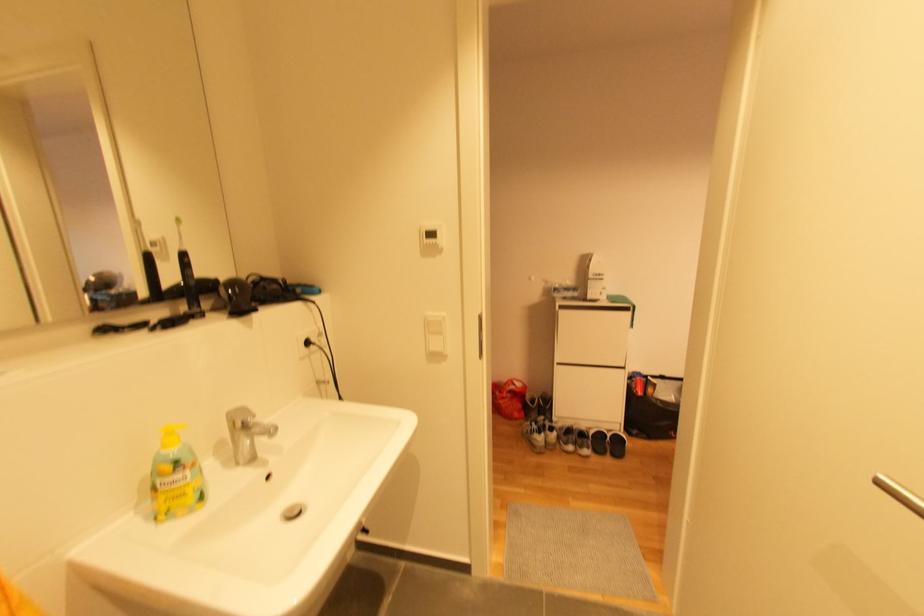
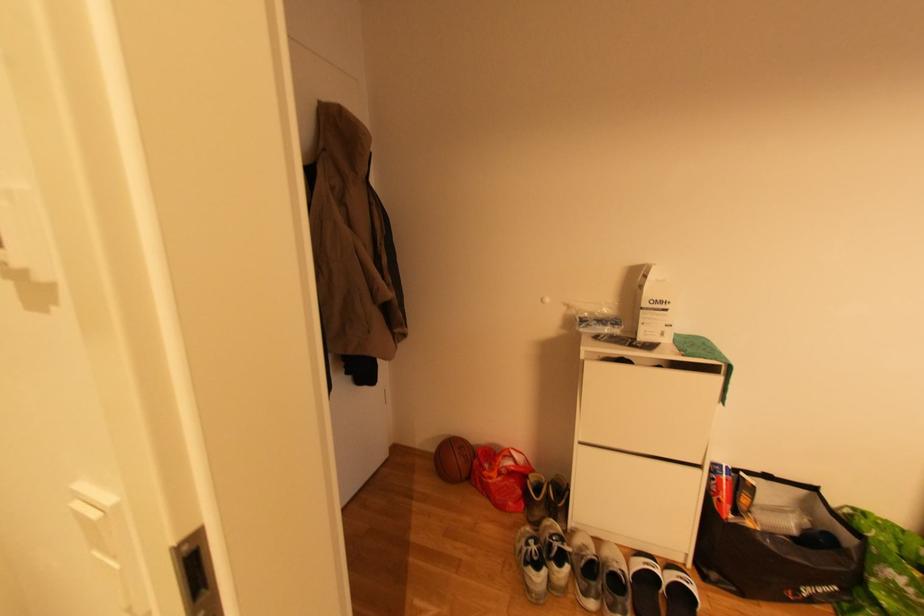
From the picture: Which direction would the cameraman need to move to produce the second image?

The cameraman moved toward right, forward.